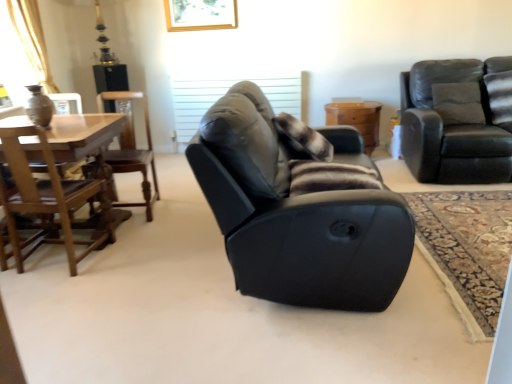
The image size is (512, 384). Find the location of `vacant space that's between black leather recliner at center, which appears as the 2th chair when viewed from the right, and wooden chair at left, marked as the 1th chair in a left-to-right arrangement`. vacant space that's between black leather recliner at center, which appears as the 2th chair when viewed from the right, and wooden chair at left, marked as the 1th chair in a left-to-right arrangement is located at coordinates (148, 258).